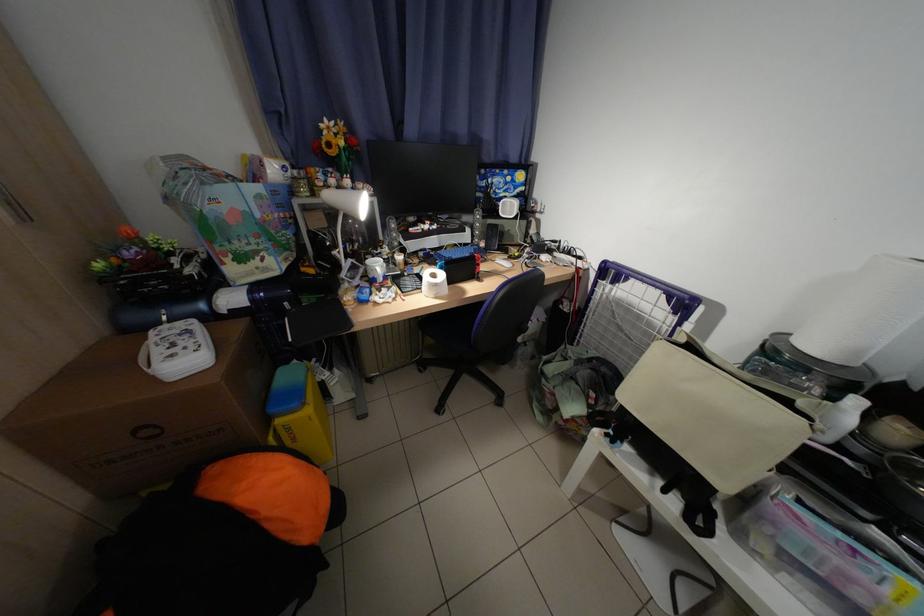
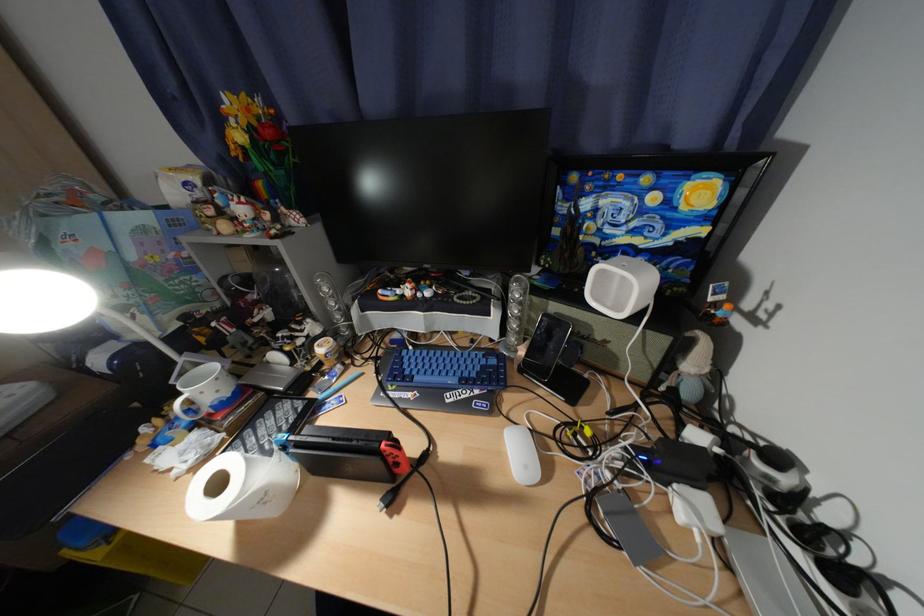
Locate, in the second image, the point that corresponds to point 555,259 in the first image.

(700, 508)